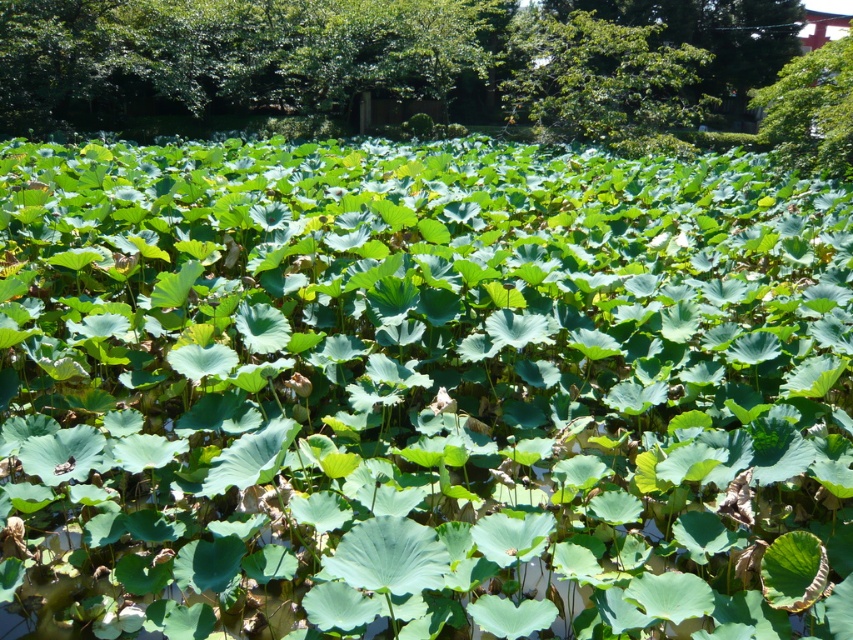
Question: Which point is closer to the camera?

Choices:
 (A) (775, 86)
 (B) (543, 49)

Answer: (A)

Question: Considering the relative positions of green leafy tree at upper center and green leafy tree at upper right in the image provided, where is green leafy tree at upper center located with respect to green leafy tree at upper right?

Choices:
 (A) left
 (B) right

Answer: (A)

Question: Can you confirm if green leafy tree at upper center is positioned to the right of green leafy tree at upper right?

Choices:
 (A) no
 (B) yes

Answer: (A)

Question: Can you confirm if green leafy tree at upper center is positioned above green leafy tree at upper right?

Choices:
 (A) no
 (B) yes

Answer: (B)

Question: Which of the following is the closest to the observer?

Choices:
 (A) green leafy tree at upper right
 (B) green leafy tree at upper center

Answer: (A)